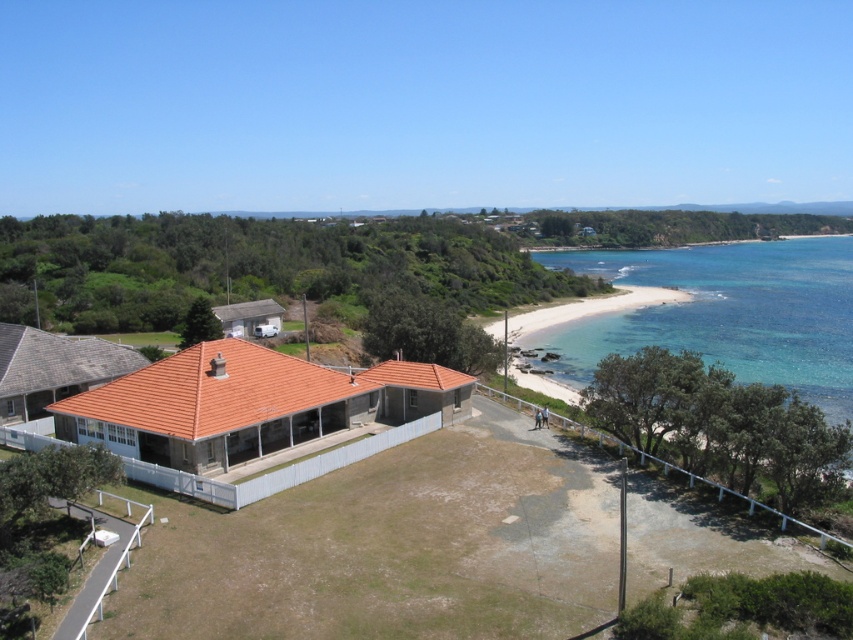
You are standing on the sand near the clear blue water at beach right and want to walk to the terracotta tiled house at center. Which direction should you head?

You should head to the left because the terracotta tiled house at center is to the left of the clear blue water at beach right.